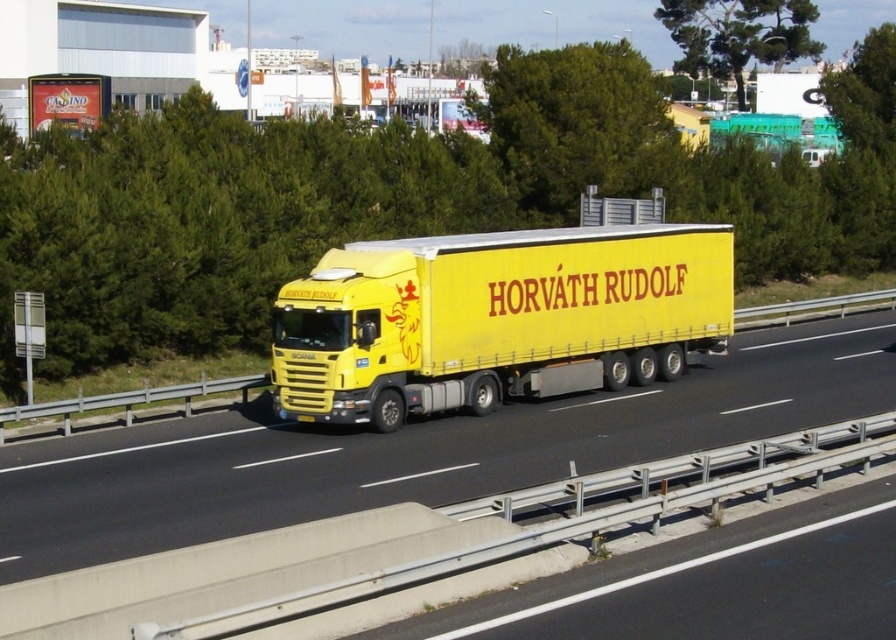
Who is lower down, yellow matte truck at center or green leafy tree at center?

yellow matte truck at center

Is point (311, 502) more distant than point (614, 116)?

That is False.

Describe the element at coordinates (416, 449) in the screenshot. Image resolution: width=896 pixels, height=640 pixels. I see `yellow matte truck at center` at that location.

Identify the location of yellow matte truck at center. (416, 449).

The image size is (896, 640). Identify the location of yellow matte truck at center. (416, 449).

Can you confirm if yellow matte truck at center is positioned above green leafy tree at upper center?

Actually, yellow matte truck at center is below green leafy tree at upper center.

Does point (306, 458) lie in front of point (762, 16)?

Yes, point (306, 458) is closer to viewer.

Locate an element on the screen. Image resolution: width=896 pixels, height=640 pixels. yellow matte truck at center is located at coordinates (416, 449).

Does green leafy tree at center have a greater height compared to green leafy tree at upper center?

Yes.

Is point (569, 145) farther from viewer compared to point (790, 52)?

No, it is not.

Where is `green leafy tree at center`? This screenshot has width=896, height=640. green leafy tree at center is located at coordinates (580, 128).